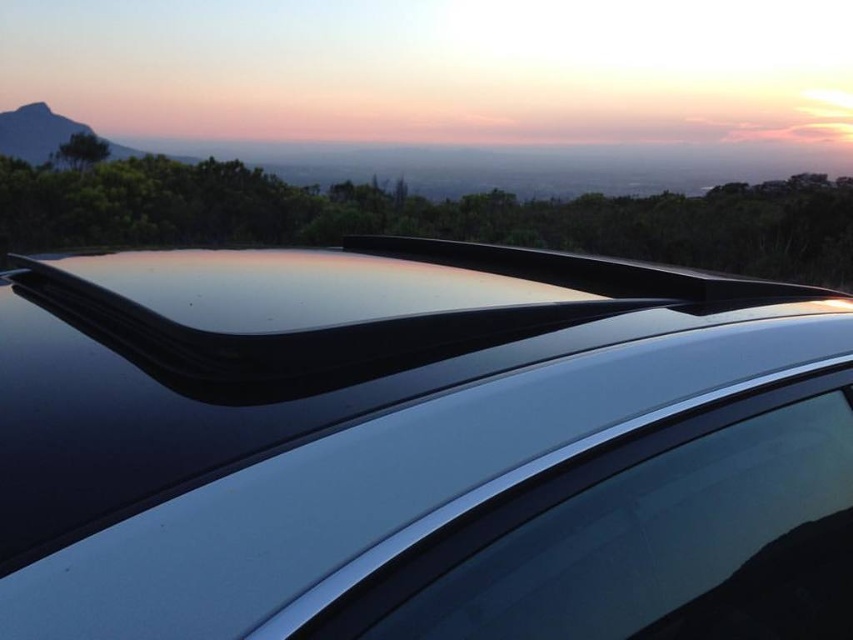
Between glossy black roof rack at upper center and satin silver glass at center, which one is positioned lower?

satin silver glass at center

Does glossy black roof rack at upper center have a lesser width compared to satin silver glass at center?

No, glossy black roof rack at upper center is not thinner than satin silver glass at center.

Identify the location of glossy black roof rack at upper center. (419, 448).

Can you confirm if satin silver glass at center is shorter than matte black rock at upper left?

Yes, satin silver glass at center is shorter than matte black rock at upper left.

Looking at this image, can you confirm if satin silver glass at center is positioned above matte black rock at upper left?

Actually, satin silver glass at center is below matte black rock at upper left.

Between point (799, 472) and point (62, 116), which one is positioned behind?

The point (62, 116) is more distant.

Locate an element on the screen. satin silver glass at center is located at coordinates (642, 536).

Is glossy black roof rack at upper center thinner than matte black rock at upper left?

Correct, glossy black roof rack at upper center's width is less than matte black rock at upper left's.

Looking at this image, who is lower down, glossy black roof rack at upper center or matte black rock at upper left?

Positioned lower is glossy black roof rack at upper center.

Which is in front, point (444, 348) or point (47, 122)?

Positioned in front is point (444, 348).

Where is `glossy black roof rack at upper center`? This screenshot has width=853, height=640. glossy black roof rack at upper center is located at coordinates (419, 448).